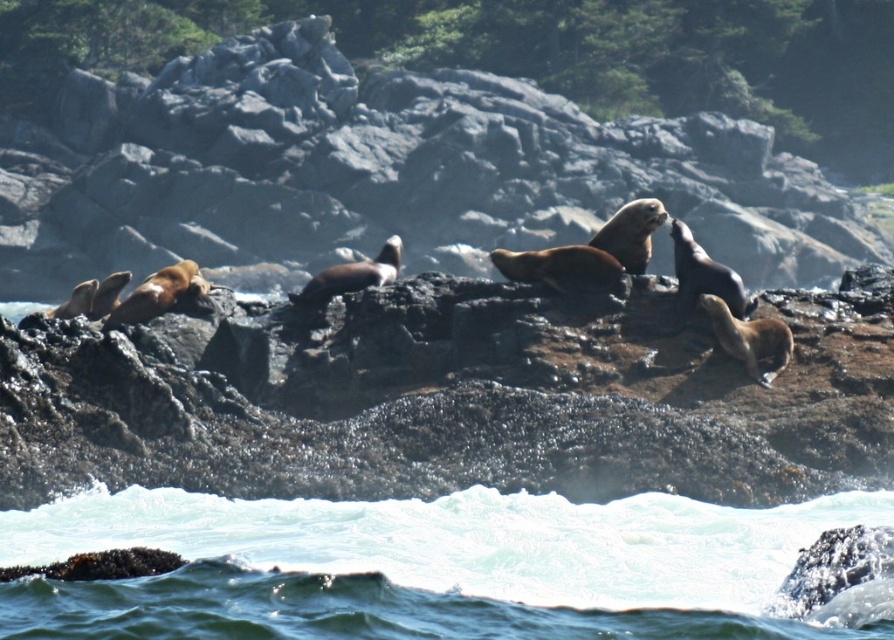
You are standing on the shore and want to walk to the clear water at lower center. Which direction should you move relative to the brown rough rock at center?

You should move to the right of the brown rough rock at center to reach the clear water at lower center since the brown rough rock at center is to the left of clear water at lower center.

You are a wildlife photographer aiming to capture a closeup shot of the brown fur seal at center without disturbing it. Since you are standing on the clear water at lower center, can you get a clear shot of the seal?

The brown fur seal at center is much taller than the clear water at lower center, so you can get a clear shot of the seal from your position on the clear water at lower center.

You are a photographer trying to capture a photo of the brown fur seal at center without including the brown rough rock at center in the frame. Based on their positions, can you position yourself in a way that allows you to exclude the rock from the shot?

The brown rough rock at center is to the left of the brown fur seal at center, so if you position yourself to the right side of the seal, you can exclude the rock from the frame.